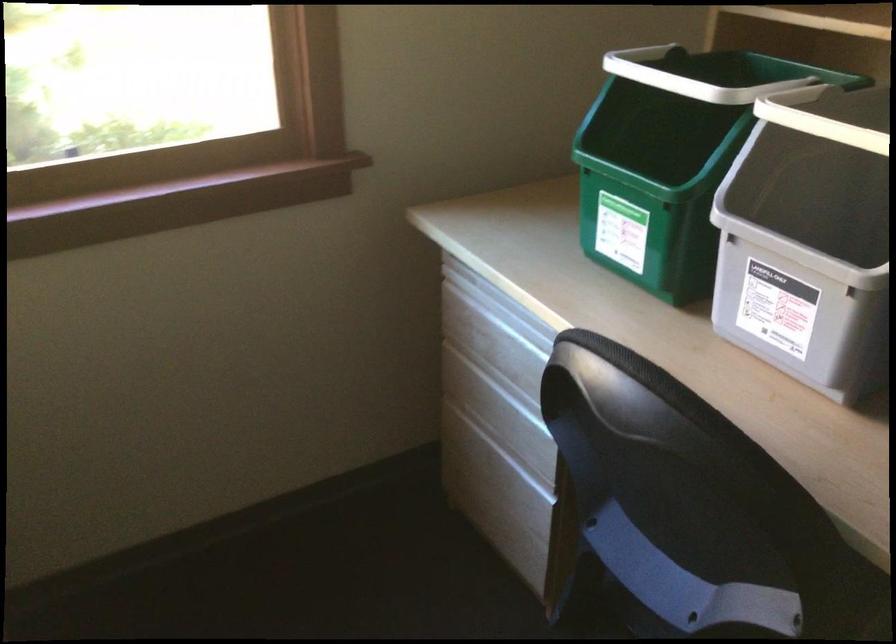
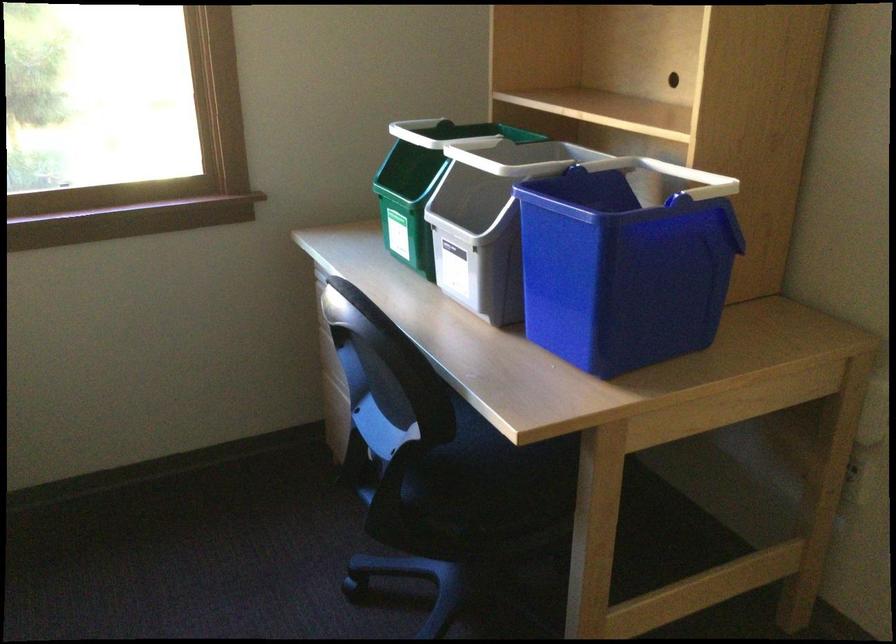
Find the pixel in the second image that matches [636,144] in the first image.

(421, 184)